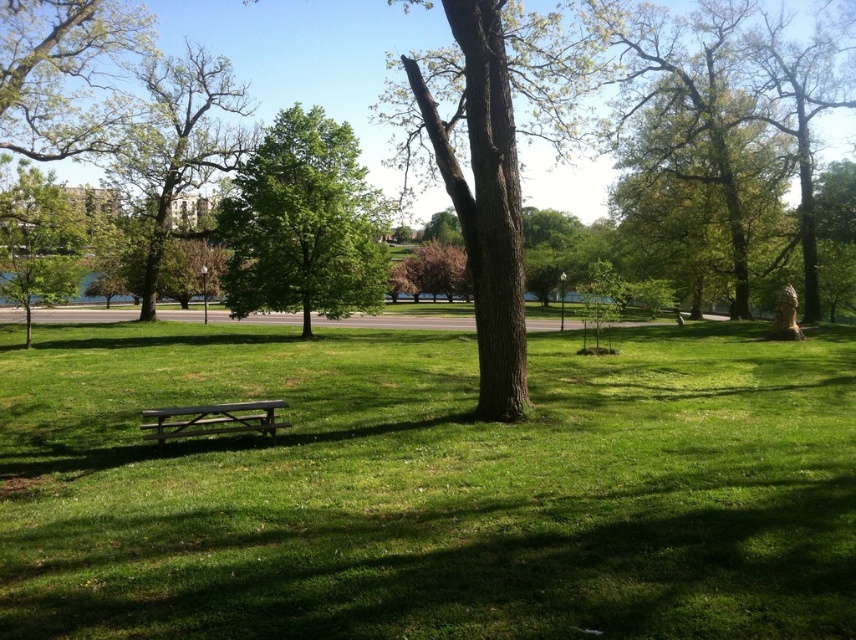
Can you confirm if green grassy at center is shorter than green leafy tree at left?

Indeed, green grassy at center has a lesser height compared to green leafy tree at left.

Who is lower down, green grassy at center or green leafy tree at left?

green grassy at center

The height and width of the screenshot is (640, 856). In order to click on green grassy at center in this screenshot , I will do `click(428, 486)`.

Measure the distance between green grassy at center and wooden picnic table at center.

green grassy at center is 2.33 meters from wooden picnic table at center.

This screenshot has width=856, height=640. I want to click on green grassy at center, so click(x=428, y=486).

This screenshot has width=856, height=640. What are the coordinates of `green grassy at center` in the screenshot? It's located at (428, 486).

Who is taller, green leafy tree at center or wooden picnic table at center?

With more height is green leafy tree at center.

Who is more distant from viewer, [296,230] or [280,422]?

The point [296,230] is behind.

In order to click on green leafy tree at center in this screenshot , I will do `click(302, 225)`.